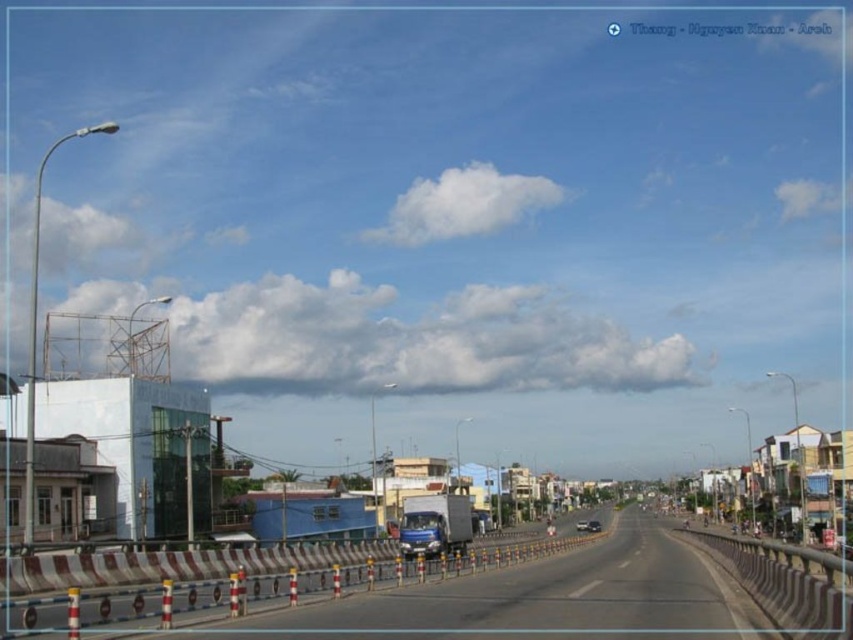
Is white plastic barrier at center thinner than metallic silver car at center?

In fact, white plastic barrier at center might be wider than metallic silver car at center.

Does white plastic barrier at center have a greater height compared to metallic silver car at center?

Correct, white plastic barrier at center is much taller as metallic silver car at center.

Is point (344, 576) farther from camera compared to point (589, 531)?

No, it is in front of (589, 531).

The height and width of the screenshot is (640, 853). Find the location of `white plastic barrier at center`. white plastic barrier at center is located at coordinates (245, 589).

Is metallic gray barrier at lower right taller than metallic silver car at center?

Yes, metallic gray barrier at lower right is taller than metallic silver car at center.

Image resolution: width=853 pixels, height=640 pixels. What do you see at coordinates (784, 586) in the screenshot?
I see `metallic gray barrier at lower right` at bounding box center [784, 586].

Which is behind, point (769, 612) or point (593, 529)?

The point (593, 529) is more distant.

Image resolution: width=853 pixels, height=640 pixels. Find the location of `metallic gray barrier at lower right`. metallic gray barrier at lower right is located at coordinates (784, 586).

Is white plastic barrier at center wider than metallic silver sedan at center?

Indeed, white plastic barrier at center has a greater width compared to metallic silver sedan at center.

Is point (9, 612) closer to viewer compared to point (579, 531)?

Yes, it is.

The height and width of the screenshot is (640, 853). I want to click on white plastic barrier at center, so click(x=245, y=589).